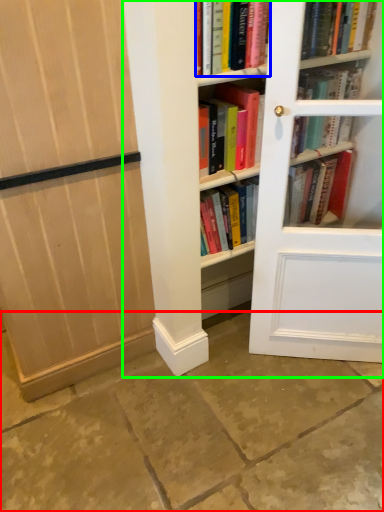
Question: Which object is positioned farthest from concrete (highlighted by a red box)? Select from book (highlighted by a blue box) and bookcase (highlighted by a green box).

Choices:
 (A) book
 (B) bookcase

Answer: (A)